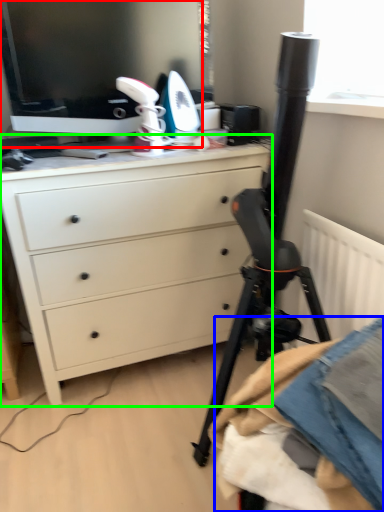
Question: Which object is positioned closest to computer monitor (highlighted by a red box)? Select from clothing (highlighted by a blue box) and chest of drawers (highlighted by a green box).

Choices:
 (A) clothing
 (B) chest of drawers

Answer: (B)